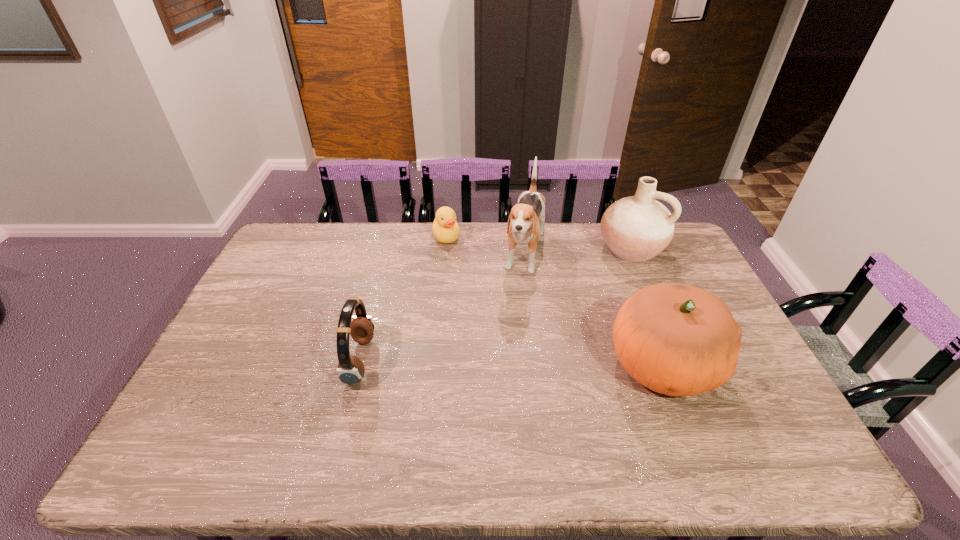
Identify the location of free space located 0.130m at the beak of the duck. The height and width of the screenshot is (540, 960). (453, 269).

Identify the location of vacant space located 0.220m to pour from the handle of the pottery. (587, 300).

You are a GUI agent. You are given a task and a screenshot of the screen. Output one action in this format:
    pyautogui.click(x=<x>, y=<y>)
    Task: Click on the free point located to pour from the handle of the pottery
    The image size is (960, 540).
    Given the screenshot: What is the action you would take?
    pyautogui.click(x=585, y=301)

Locate an element on the screen. This screenshot has width=960, height=540. vacant space situated 0.230m to pour from the handle of the pottery is located at coordinates (585, 301).

This screenshot has height=540, width=960. Find the location of `vacant space located 0.290m at the face of the third object from right to left`. vacant space located 0.290m at the face of the third object from right to left is located at coordinates (508, 355).

Find the location of `free spot located 0.100m at the face of the third object from right to left`. free spot located 0.100m at the face of the third object from right to left is located at coordinates (519, 309).

Where is `blank area located 0.280m at the face of the third object from right to left`? The height and width of the screenshot is (540, 960). blank area located 0.280m at the face of the third object from right to left is located at coordinates (508, 353).

I want to click on duck situated at the far edge, so click(x=445, y=228).

The height and width of the screenshot is (540, 960). I want to click on pottery located in the far edge section of the desktop, so click(x=637, y=228).

Where is `puppy that is at the far edge`? Image resolution: width=960 pixels, height=540 pixels. puppy that is at the far edge is located at coordinates (526, 221).